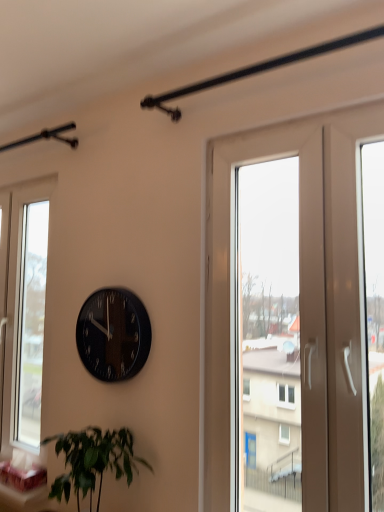
Question: Is green leafy plant at lower left in front of or behind white glossy screen door at right in the image?

Choices:
 (A) behind
 (B) front

Answer: (A)

Question: From a real-world perspective, relative to white glossy screen door at right, is green leafy plant at lower left vertically above or below?

Choices:
 (A) above
 (B) below

Answer: (B)

Question: Which object is the closest to the black glossy clock at center?

Choices:
 (A) white glossy screen door at right
 (B) transparent glass window at left
 (C) green leafy plant at lower left

Answer: (C)

Question: Estimate the real-world distances between objects in this image. Which object is closer to the green leafy plant at lower left?

Choices:
 (A) white glossy screen door at right
 (B) transparent glass window at left
 (C) black glossy clock at center

Answer: (C)